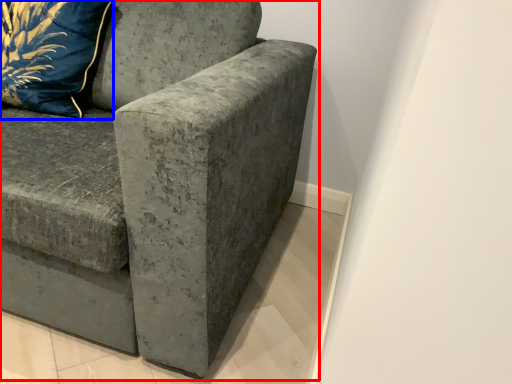
Question: Which point is closer to the camera, studio couch (highlighted by a red box) or pillow (highlighted by a blue box)?

Choices:
 (A) studio couch
 (B) pillow

Answer: (A)